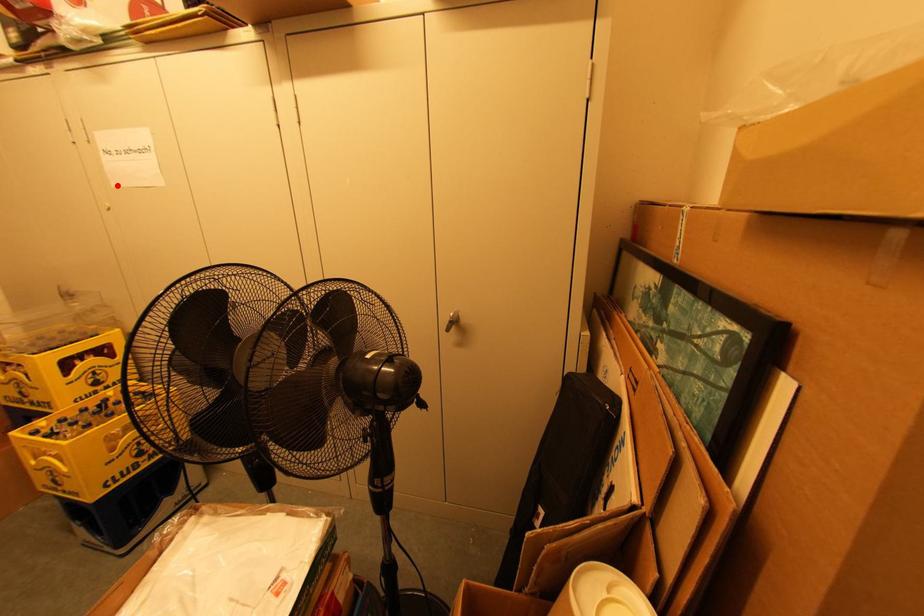
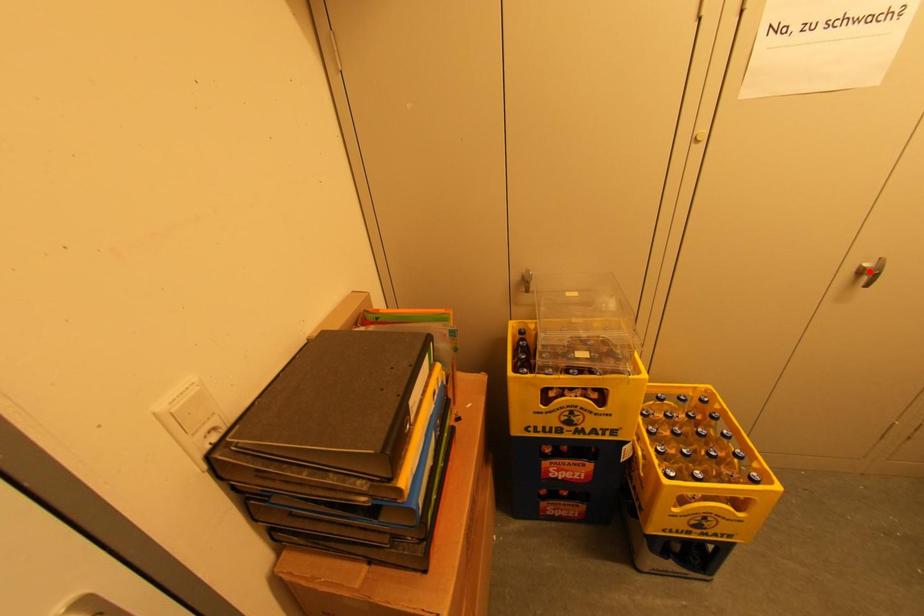
I am providing you with two images of the same scene from different viewpoints. A red point is marked on the first image and another point is marked on the second image. Does the point marked in image1 correspond to the same location as the one in image2?

No